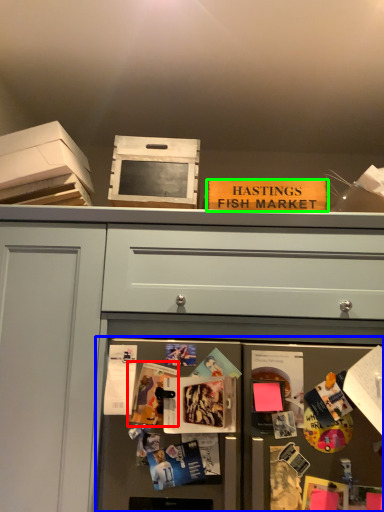
Question: Based on their relative distances, which object is farther from magazine (highlighted by a red box)? Choose from fridge (highlighted by a blue box) and magazine (highlighted by a green box).

Choices:
 (A) fridge
 (B) magazine

Answer: (B)